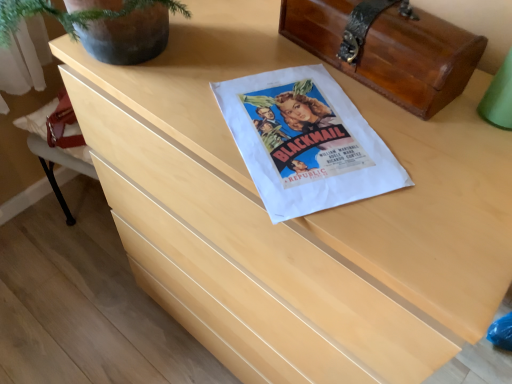
Locate an element on the screen. empty space that is to the right of white paper flyer at center is located at coordinates (448, 153).